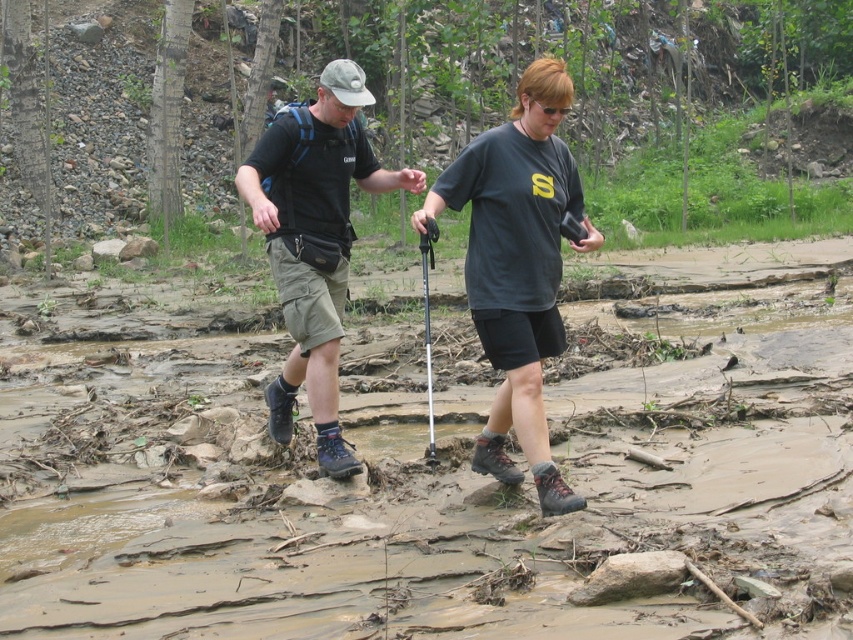
Question: Does matte black t-shirt at center have a smaller size compared to black fabric shorts at center?

Choices:
 (A) yes
 (B) no

Answer: (A)

Question: Which of the following is the closest to the observer?

Choices:
 (A) matte black t-shirt at center
 (B) black fabric shorts at center

Answer: (B)

Question: Can you confirm if matte black t-shirt at center is positioned above black fabric shorts at center?

Choices:
 (A) yes
 (B) no

Answer: (A)

Question: Which object appears closest to the camera in this image?

Choices:
 (A) matte black t-shirt at center
 (B) black fabric shorts at center

Answer: (B)

Question: Is matte black t-shirt at center positioned behind black fabric shorts at center?

Choices:
 (A) yes
 (B) no

Answer: (A)